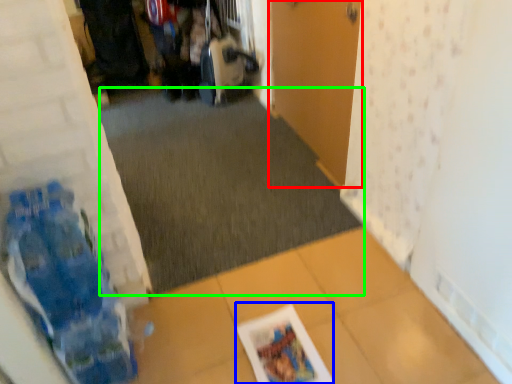
Question: Based on their relative distances, which object is nearer to door (highlighted by a red box)? Choose from magazine (highlighted by a blue box) and plain (highlighted by a green box).

Choices:
 (A) magazine
 (B) plain

Answer: (B)